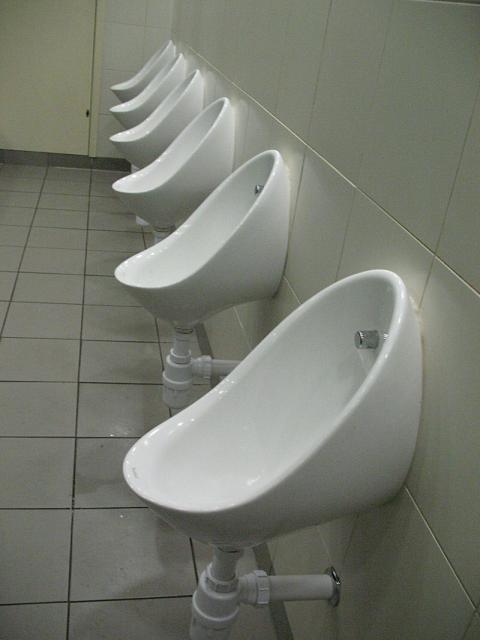
This screenshot has width=480, height=640. Find the location of `urinel`. urinel is located at coordinates (331, 448), (226, 260), (185, 156), (151, 116), (144, 100), (136, 73).